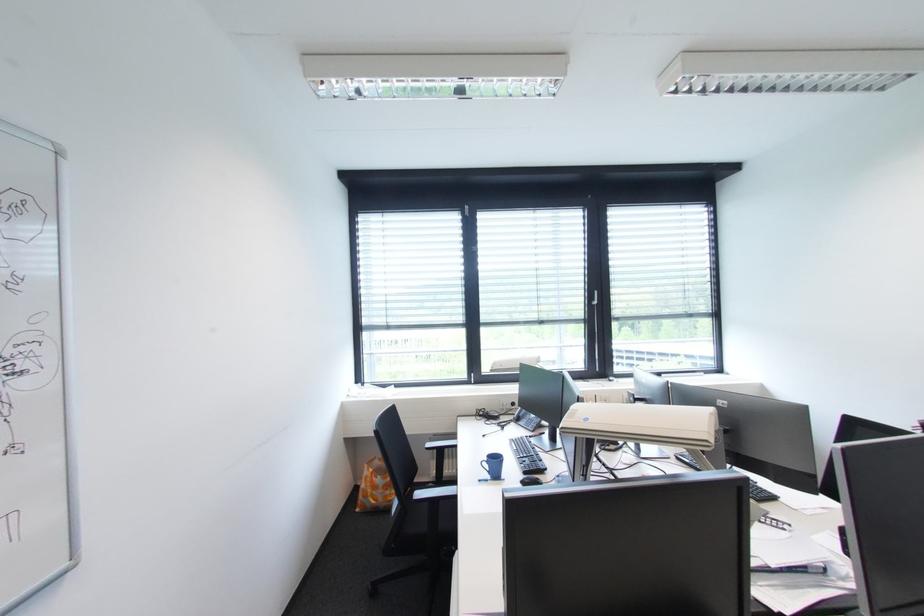
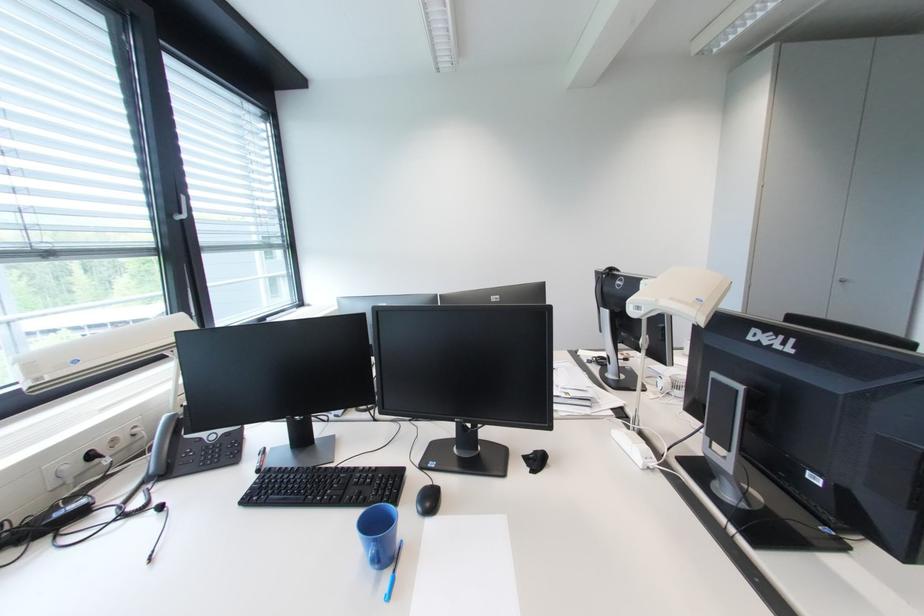
Locate, in the second image, the point that corresponds to [518,406] in the first image.

(98, 458)